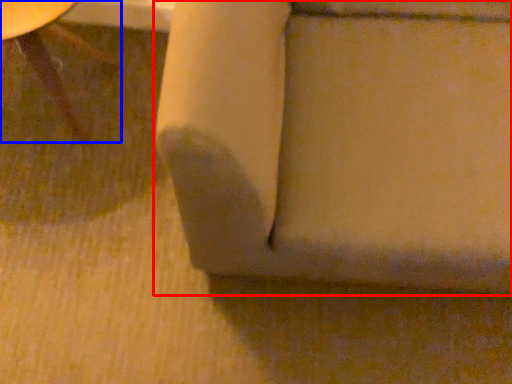
Question: Which object appears closest to the camera in this image, furniture (highlighted by a red box) or furniture (highlighted by a blue box)?

Choices:
 (A) furniture
 (B) furniture

Answer: (A)